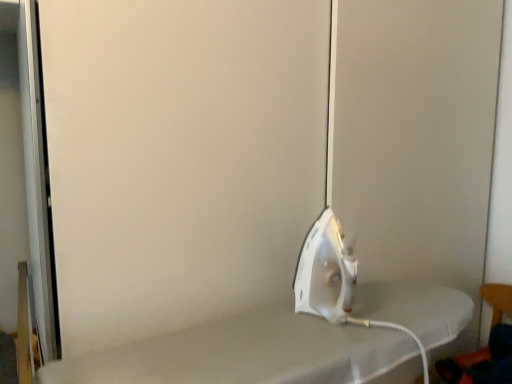
Question: Is wooden chair at lower right next to white glossy iron at center and touching it?

Choices:
 (A) no
 (B) yes

Answer: (A)

Question: Is wooden chair at lower right smaller than white glossy iron at center?

Choices:
 (A) no
 (B) yes

Answer: (A)

Question: Is wooden chair at lower right in front of white glossy iron at center?

Choices:
 (A) no
 (B) yes

Answer: (A)

Question: Can you confirm if wooden chair at lower right is bigger than white glossy iron at center?

Choices:
 (A) no
 (B) yes

Answer: (B)

Question: Can you confirm if wooden chair at lower right is positioned to the right of white glossy iron at center?

Choices:
 (A) no
 (B) yes

Answer: (B)

Question: Does wooden chair at lower right have a lesser width compared to white glossy iron at center?

Choices:
 (A) yes
 (B) no

Answer: (B)

Question: Does white glossy iron at center have a smaller size compared to wooden chair at lower right?

Choices:
 (A) yes
 (B) no

Answer: (A)

Question: Is white glossy iron at center touching wooden chair at lower right?

Choices:
 (A) yes
 (B) no

Answer: (B)

Question: Considering the relative positions of white glossy iron at center and wooden chair at lower right in the image provided, is white glossy iron at center behind wooden chair at lower right?

Choices:
 (A) no
 (B) yes

Answer: (A)

Question: Is white glossy iron at center positioned in front of wooden chair at lower right?

Choices:
 (A) no
 (B) yes

Answer: (B)

Question: From a real-world perspective, is white glossy iron at center under wooden chair at lower right?

Choices:
 (A) no
 (B) yes

Answer: (A)

Question: From the image's perspective, would you say white glossy iron at center is positioned over wooden chair at lower right?

Choices:
 (A) no
 (B) yes

Answer: (B)

Question: From a real-world perspective, is white glossy iron at center physically located above or below wooden chair at lower right?

Choices:
 (A) above
 (B) below

Answer: (A)